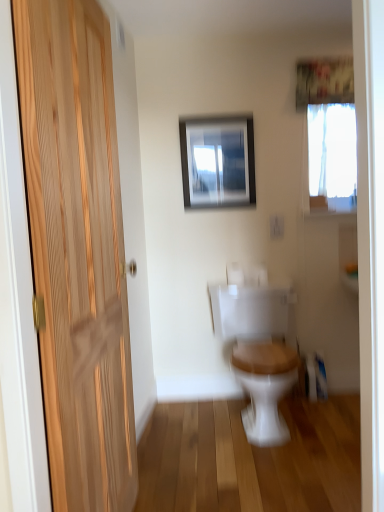
Question: Considering the positions of wooden door at left and metallic silver picture frame at upper center in the image, is wooden door at left bigger or smaller than metallic silver picture frame at upper center?

Choices:
 (A) big
 (B) small

Answer: (A)

Question: In terms of height, does wooden door at left look taller or shorter compared to metallic silver picture frame at upper center?

Choices:
 (A) tall
 (B) short

Answer: (A)

Question: Estimate the real-world distances between objects in this image. Which object is farther from the white wood toilet at center?

Choices:
 (A) wooden door at left
 (B) white sheer curtain at upper center
 (C) metallic silver picture frame at upper center

Answer: (B)

Question: Estimate the real-world distances between objects in this image. Which object is farther from the white sheer curtain at upper center?

Choices:
 (A) metallic silver picture frame at upper center
 (B) wooden door at left
 (C) white wood toilet at center

Answer: (B)